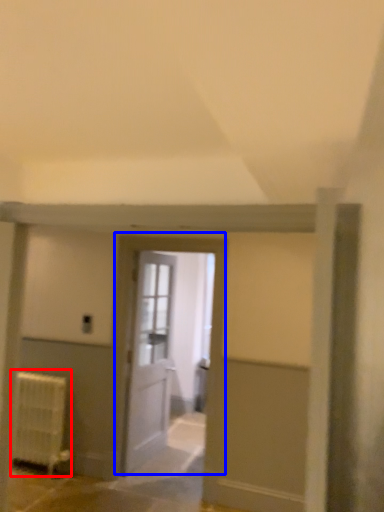
Question: Which object appears closest to the camera in this image, radiator (highlighted by a red box) or door (highlighted by a blue box)?

Choices:
 (A) radiator
 (B) door

Answer: (B)